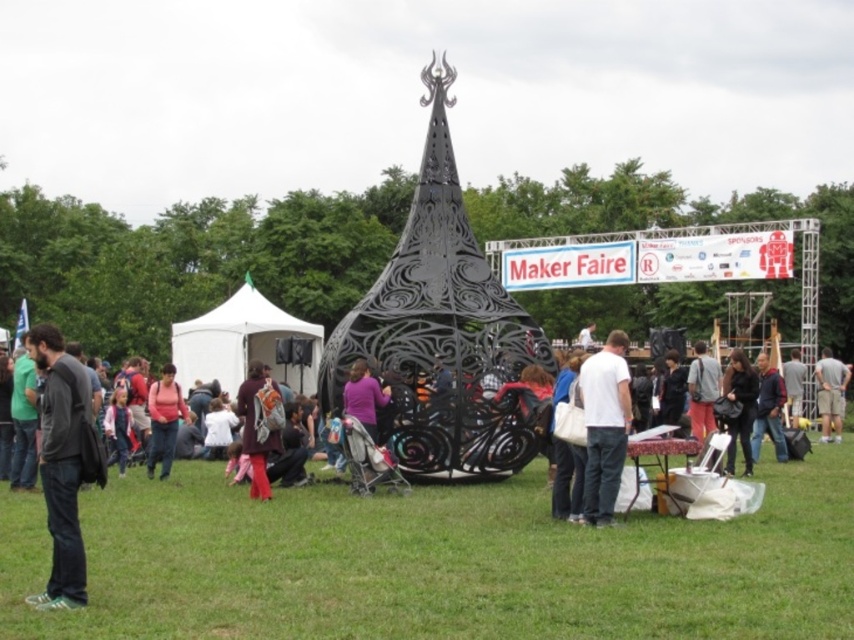
You are a photographer at the Maker Faire trying to capture a photo of the metal sculpture. You want to ensure that both the green grass at center and the light brown leather jacket at center are visible in the frame. Which object should you position closer to the camera to include both in the shot without cropping?

The light brown leather jacket at center should be positioned closer to the camera. Since the green grass at center might be wider than the light brown leather jacket at center, moving the jacket forward would help fit both into the frame by reducing the required width for the grass.

You are a photographer at the Maker Faire. You want to take a photo of the two jackets mentioned in the scene. Since the matte black jacket at center and the denim jacket at center are both at the center, which one should you focus on first if you want to capture both in a single frame without moving the camera?

The matte black jacket at center is taller than the denim jacket at center, so you should focus on the taller matte black jacket at center first to ensure it is in clear view before adjusting the focus to include the shorter denim jacket at center.

You are standing at the entrance of the Maker Faire and want to find the green grass at center. According to the coordinates provided, where should you look to locate it?

The green grass at center is located at point (437, 563), so you should look towards the lower right area of the image since the coordinates are closer to the bottom right corner.